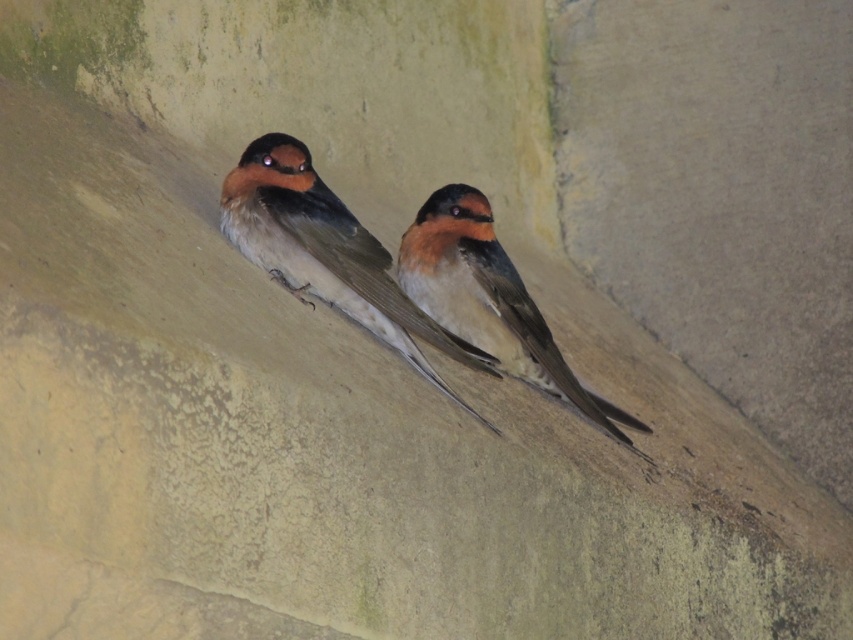
Question: Which of the following is the closest to the observer?

Choices:
 (A) (498, 362)
 (B) (380, 280)

Answer: (B)

Question: Which object appears farthest from the camera in this image?

Choices:
 (A) brown matte swallow at center
 (B) brown feathered swallow at center

Answer: (A)

Question: Is the position of brown feathered swallow at center more distant than that of brown matte swallow at center?

Choices:
 (A) yes
 (B) no

Answer: (B)

Question: Which point appears closest to the camera in this image?

Choices:
 (A) (437, 332)
 (B) (538, 344)

Answer: (A)

Question: In this image, where is brown feathered swallow at center located relative to brown matte swallow at center?

Choices:
 (A) above
 (B) below

Answer: (A)

Question: Considering the relative positions of brown feathered swallow at center and brown matte swallow at center in the image provided, where is brown feathered swallow at center located with respect to brown matte swallow at center?

Choices:
 (A) below
 (B) above

Answer: (B)